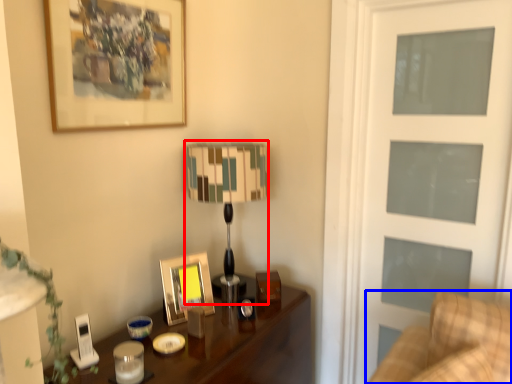
Question: Which object is further to the camera taking this photo, table lamp (highlighted by a red box) or furniture (highlighted by a blue box)?

Choices:
 (A) table lamp
 (B) furniture

Answer: (A)